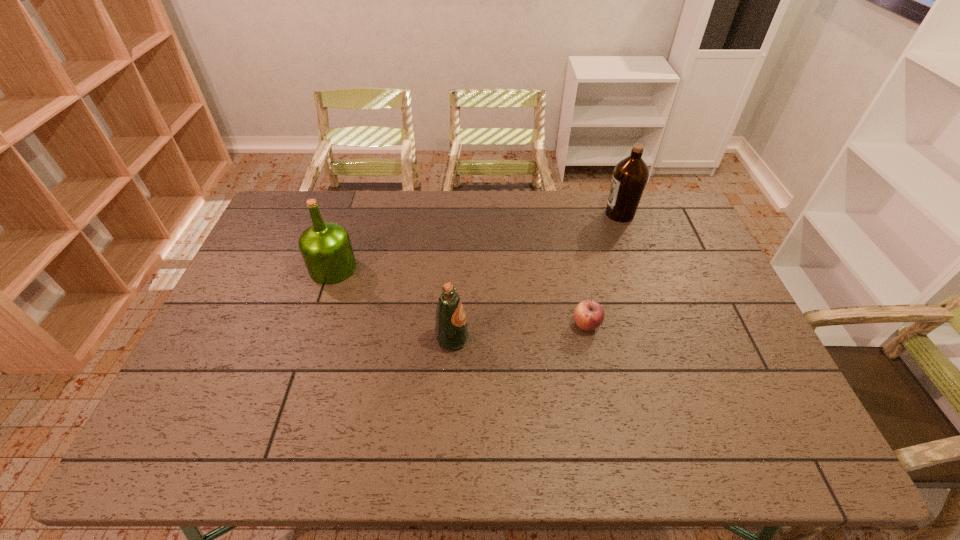
Find the location of a particular element. This screenshot has width=960, height=540. the rightmost olive oil is located at coordinates 630,176.

Where is `the rightmost object`? Image resolution: width=960 pixels, height=540 pixels. the rightmost object is located at coordinates (630, 176).

Where is `the second farthest olive oil`? the second farthest olive oil is located at coordinates (326, 248).

Find the location of a particular element. The width and height of the screenshot is (960, 540). the third nearest object is located at coordinates (326, 248).

Image resolution: width=960 pixels, height=540 pixels. I want to click on the shortest olive oil, so click(x=451, y=330).

Where is `the nearest olive oil`? The height and width of the screenshot is (540, 960). the nearest olive oil is located at coordinates (451, 330).

This screenshot has width=960, height=540. Identify the location of the third object from left to right. (588, 315).

You are a GUI agent. You are given a task and a screenshot of the screen. Output one action in this format:
    pyautogui.click(x=<x>, y=<y>)
    Task: Click on the shortest object
    
    Given the screenshot: What is the action you would take?
    pyautogui.click(x=588, y=315)

Identify the location of vacant space situated 0.390m on the label of the rightmost olive oil. Image resolution: width=960 pixels, height=540 pixels. (497, 214).

Image resolution: width=960 pixels, height=540 pixels. Identify the location of vacant space located 0.200m on the label of the rightmost olive oil. (549, 214).